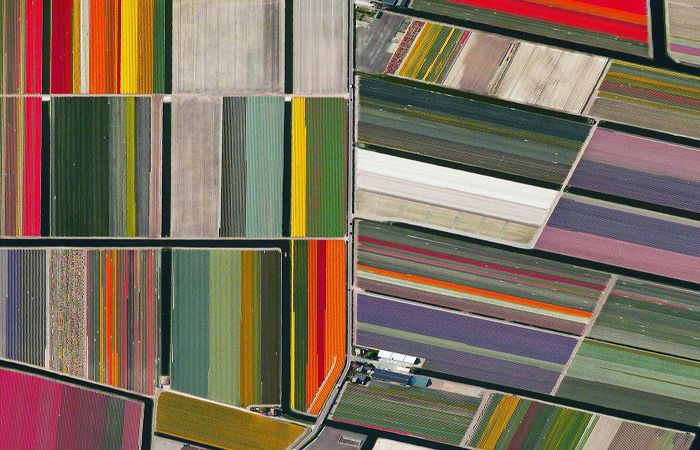
Identify the location of diagonal rugs from lower right. This screenshot has height=450, width=700. point(526,310), point(652,360).